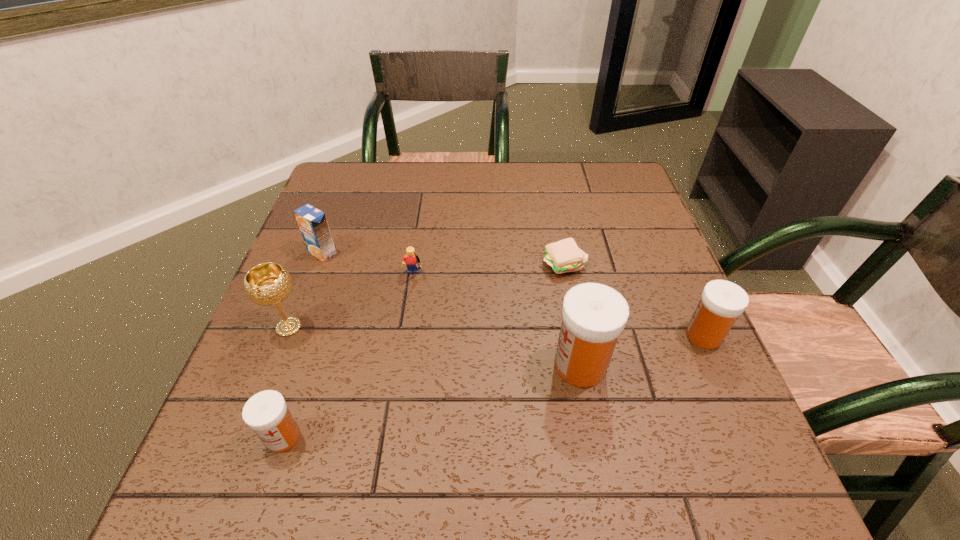
Locate an element on the screen. The width and height of the screenshot is (960, 540). vacant space that is in between the chalice and the patty is located at coordinates (426, 296).

Where is `empty location between the nearest object and the patty`? The height and width of the screenshot is (540, 960). empty location between the nearest object and the patty is located at coordinates (423, 351).

Find the location of a particular element. empty space between the rightmost medicine and the tallest medicine is located at coordinates (642, 350).

This screenshot has width=960, height=540. Find the location of `vacant space that is in between the orange_juice and the leftmost medicine`. vacant space that is in between the orange_juice and the leftmost medicine is located at coordinates (302, 345).

What are the coordinates of `free space between the chalice and the fourth object from right to left` in the screenshot? It's located at (350, 302).

The height and width of the screenshot is (540, 960). What are the coordinates of `the fourth closest object to the fourth object from left to right` in the screenshot? It's located at (594, 315).

I want to click on object that stands as the third closest to the patty, so click(411, 260).

Locate which medicine ranks second in proximity to the leftmost medicine. Please provide its 2D coordinates. Your answer should be formatted as a tuple, i.e. [(x, y)], where the tuple contains the x and y coordinates of a point satisfying the conditions above.

[(721, 303)]

Where is `medicine that can be found as the closest to the second shortest medicine`? The height and width of the screenshot is (540, 960). medicine that can be found as the closest to the second shortest medicine is located at coordinates [594, 315].

Identify the location of free region that satisfies the following two spatial constraints: 1. on the front side of the leftmost medicine; 2. on the right side of the orange_juice. (252, 437).